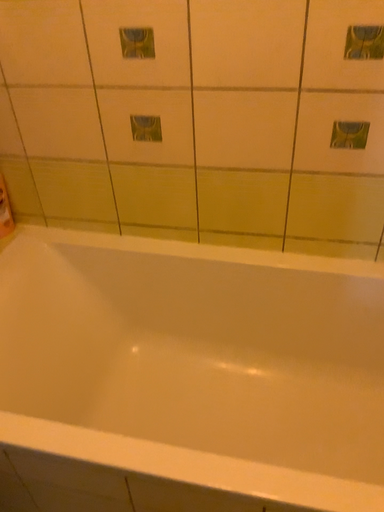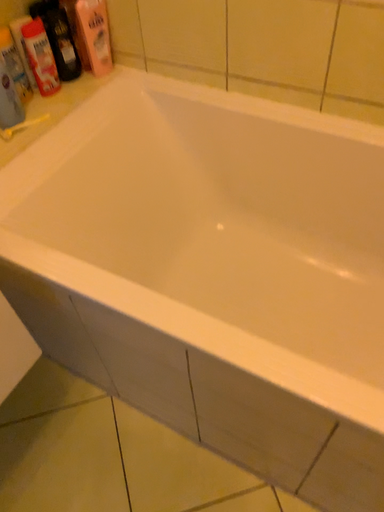
Question: Which way did the camera rotate in the video?

Choices:
 (A) rotated left
 (B) rotated right

Answer: (A)